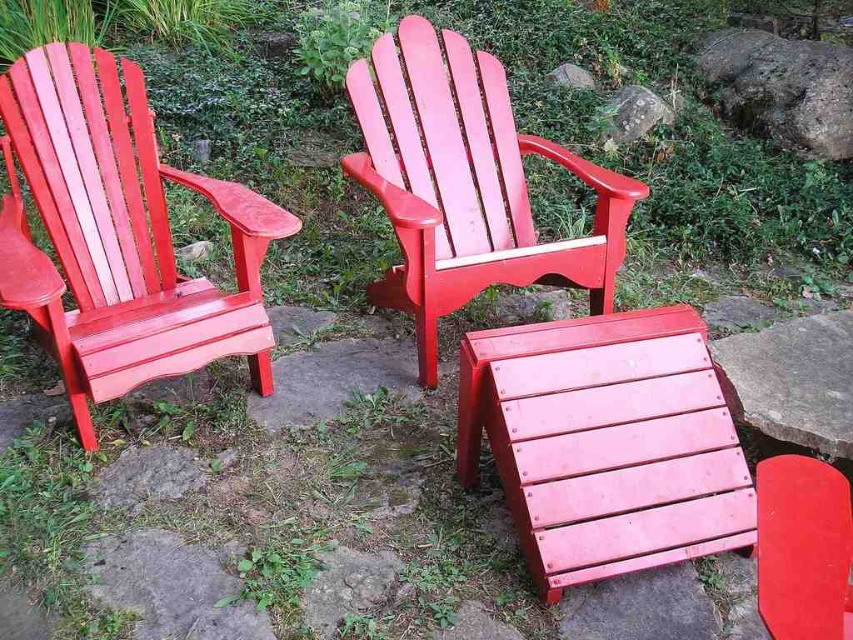
Looking at this image, you are planning to place a small table between the matte wood chair at left and the matte wood chair at center. Considering their sizes, which chair will have more space between it and the table?

The matte wood chair at left is smaller than the matte wood chair at center, so the smaller chair will have more space between it and the table.

You are standing at the edge of the stone area and want to place a small potted plant between the smooth gray stone at center and the smooth gray rock at upper center. Which object should you place the plant closer to so it is nearer to the viewer?

You should place the plant closer to the smooth gray stone at center because it is nearer to the viewer compared to the smooth gray rock at upper center.

You are a hiker who wants to place a small backpack between the smooth gray stone at center and the smooth gray rock at upper center. Based on their positions, which object should you place the backpack closer to in order to keep it centered between them?

You should place the backpack closer to the smooth gray rock at upper center because the smooth gray stone at center is to the right of it, so the center point between them would be closer to the upper rock.